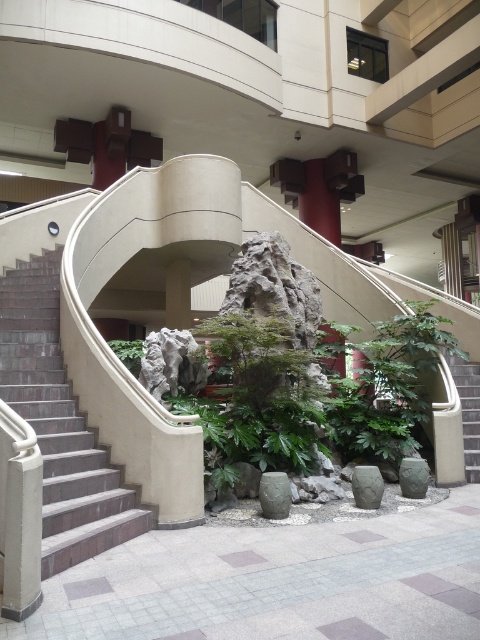
You are a delivery person carrying a large package and need to navigate through the indoor space. The brick stairs at left and the green leafy plant at center are in your path. Which object should you avoid bumping into to ensure the package remains undamaged?

You should avoid bumping into the brick stairs at left because it is bigger than the green leafy plant at center, making it more likely to damage the package if collided with.